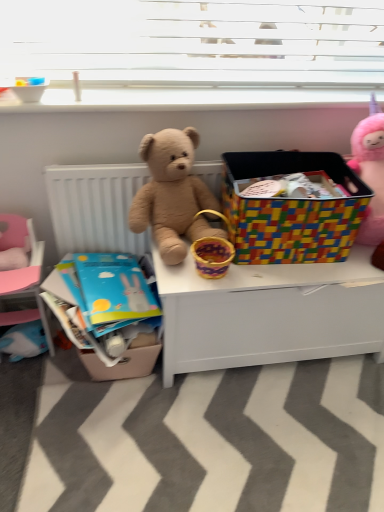
Question: Would you say white smooth window sill at upper center contains multicolored plastic storage bin at center?

Choices:
 (A) yes
 (B) no

Answer: (B)

Question: Is white smooth window sill at upper center bigger than multicolored plastic storage bin at center?

Choices:
 (A) no
 (B) yes

Answer: (A)

Question: Does white smooth window sill at upper center have a lesser width compared to multicolored plastic storage bin at center?

Choices:
 (A) yes
 (B) no

Answer: (A)

Question: Is white smooth window sill at upper center touching multicolored plastic storage bin at center?

Choices:
 (A) no
 (B) yes

Answer: (A)

Question: Is white smooth window sill at upper center to the right of multicolored plastic storage bin at center from the viewer's perspective?

Choices:
 (A) yes
 (B) no

Answer: (B)

Question: Is white smooth window sill at upper center looking in the opposite direction of multicolored plastic storage bin at center?

Choices:
 (A) yes
 (B) no

Answer: (B)

Question: Is white matte desk at center taller than fuzzy brown teddy bear at center?

Choices:
 (A) yes
 (B) no

Answer: (A)

Question: Is white matte desk at center at the left side of fuzzy brown teddy bear at center?

Choices:
 (A) no
 (B) yes

Answer: (A)

Question: Is white matte desk at center not inside fuzzy brown teddy bear at center?

Choices:
 (A) yes
 (B) no

Answer: (A)

Question: From a real-world perspective, is white matte desk at center over fuzzy brown teddy bear at center?

Choices:
 (A) no
 (B) yes

Answer: (A)

Question: Can you confirm if white matte desk at center is shorter than fuzzy brown teddy bear at center?

Choices:
 (A) no
 (B) yes

Answer: (A)

Question: From the image's perspective, is white matte desk at center above fuzzy brown teddy bear at center?

Choices:
 (A) yes
 (B) no

Answer: (B)

Question: Is multicolored plastic storage bin at center closer to the viewer compared to fluffy pink unicorn at upper right?

Choices:
 (A) yes
 (B) no

Answer: (B)